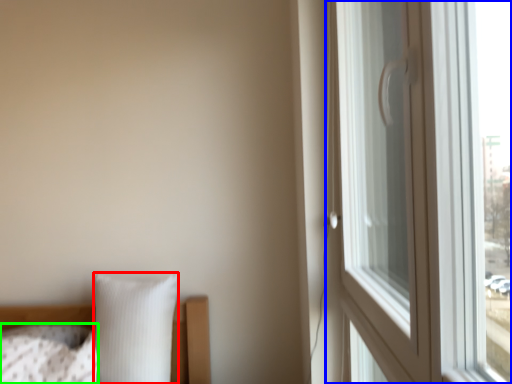
Question: Which is farther away from pillow (highlighted by a red box)? window (highlighted by a blue box) or pillow (highlighted by a green box)?

Choices:
 (A) window
 (B) pillow

Answer: (A)